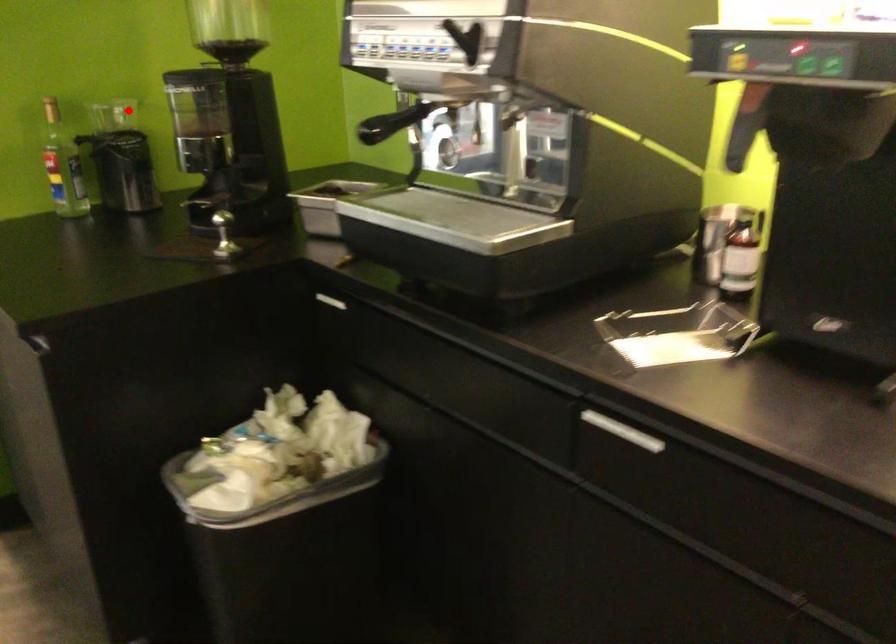
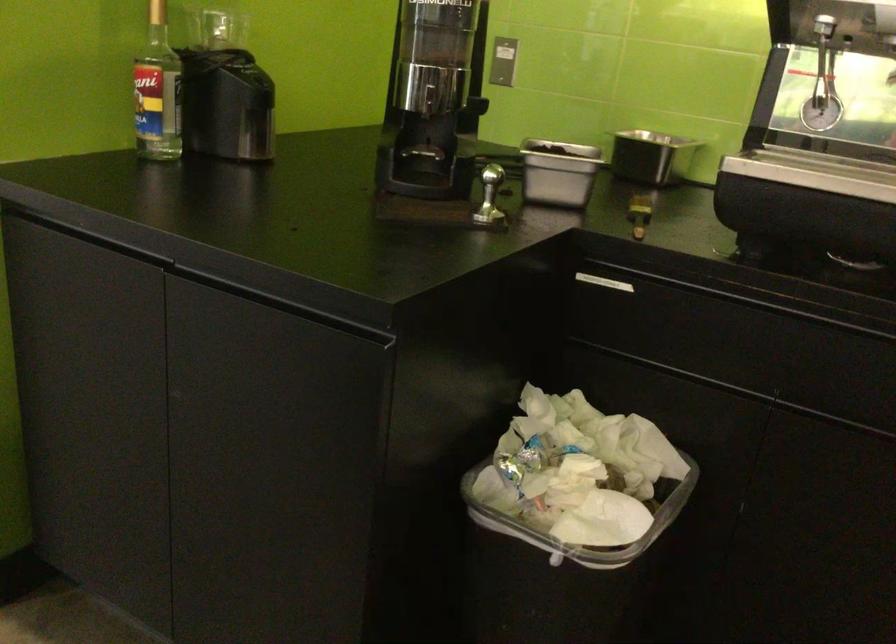
The point at the highlighted location is marked in the first image. Where is the corresponding point in the second image?

(216, 29)